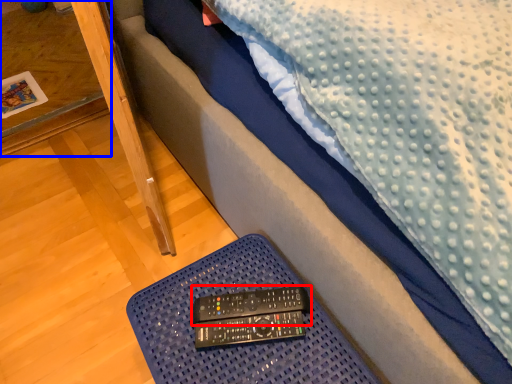
Question: Which object is closer to the camera taking this photo, control (highlighted by a red box) or table (highlighted by a blue box)?

Choices:
 (A) control
 (B) table

Answer: (A)